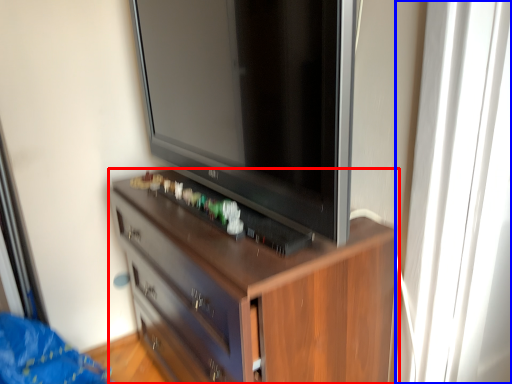
Question: Which point is further to the camera, chest of drawers (highlighted by a red box) or glass door (highlighted by a blue box)?

Choices:
 (A) chest of drawers
 (B) glass door

Answer: (B)